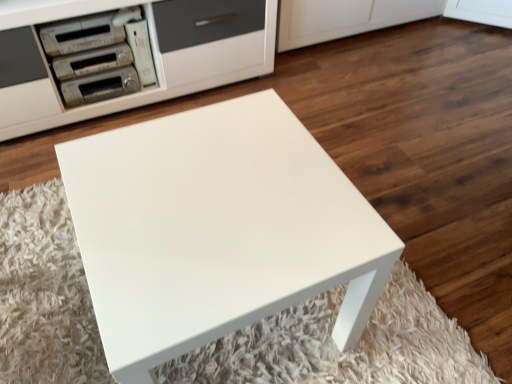
Question: From a real-world perspective, is metallic silver appliance at upper left, the 1th appliance positioned from the back, under metallic silver stereo at upper left, which appears as the first appliance when viewed from the front?

Choices:
 (A) yes
 (B) no

Answer: (A)

Question: Is metallic silver stereo at upper left, which appears as the first appliance when viewed from the front, inside metallic silver appliance at upper left, the 1th appliance positioned from the back?

Choices:
 (A) no
 (B) yes

Answer: (A)

Question: Is there a large distance between metallic silver appliance at upper left, which is the fourth appliance in front-to-back order, and metallic silver stereo at upper left, the fourth appliance viewed from the back?

Choices:
 (A) yes
 (B) no

Answer: (B)

Question: From the image's perspective, is metallic silver appliance at upper left, the 1th appliance positioned from the back, over metallic silver stereo at upper left, which appears as the first appliance when viewed from the front?

Choices:
 (A) yes
 (B) no

Answer: (B)

Question: Is metallic silver appliance at upper left, the 1th appliance positioned from the back, looking in the opposite direction of metallic silver stereo at upper left, the fourth appliance viewed from the back?

Choices:
 (A) yes
 (B) no

Answer: (B)

Question: Is metallic silver stereo at upper left, the fourth appliance viewed from the back, situated inside white plastic game console at upper left, the third appliance positioned from the front, or outside?

Choices:
 (A) outside
 (B) inside

Answer: (A)

Question: Is metallic silver stereo at upper left, which appears as the first appliance when viewed from the front, to the left or to the right of white plastic game console at upper left, the third appliance positioned from the front, in the image?

Choices:
 (A) right
 (B) left

Answer: (B)

Question: Looking at their shapes, would you say metallic silver stereo at upper left, the fourth appliance viewed from the back, is wider or thinner than white plastic game console at upper left, the third appliance positioned from the front?

Choices:
 (A) thin
 (B) wide

Answer: (A)

Question: In the image, is metallic silver stereo at upper left, the fourth appliance viewed from the back, positioned in front of or behind white plastic game console at upper left, which is the 2th appliance from back to front?

Choices:
 (A) behind
 (B) front

Answer: (B)

Question: In terms of height, does white glossy table at center look taller or shorter compared to matte silver stereo at upper left, marked as the 2th appliance in a front-to-back arrangement?

Choices:
 (A) tall
 (B) short

Answer: (A)

Question: Is white glossy table at center to the left or to the right of matte silver stereo at upper left, acting as the third appliance starting from the back, in the image?

Choices:
 (A) left
 (B) right

Answer: (B)

Question: Do you think white glossy table at center is within matte silver stereo at upper left, acting as the third appliance starting from the back, or outside of it?

Choices:
 (A) inside
 (B) outside

Answer: (B)

Question: Is white glossy table at center in front of or behind matte silver stereo at upper left, acting as the third appliance starting from the back, in the image?

Choices:
 (A) front
 (B) behind

Answer: (A)

Question: In the image, is metallic silver appliance at upper left, which is the fourth appliance in front-to-back order, positioned in front of or behind matte silver stereo at upper left, acting as the third appliance starting from the back?

Choices:
 (A) behind
 (B) front

Answer: (A)

Question: Is metallic silver appliance at upper left, which is the fourth appliance in front-to-back order, taller or shorter than matte silver stereo at upper left, acting as the third appliance starting from the back?

Choices:
 (A) short
 (B) tall

Answer: (B)